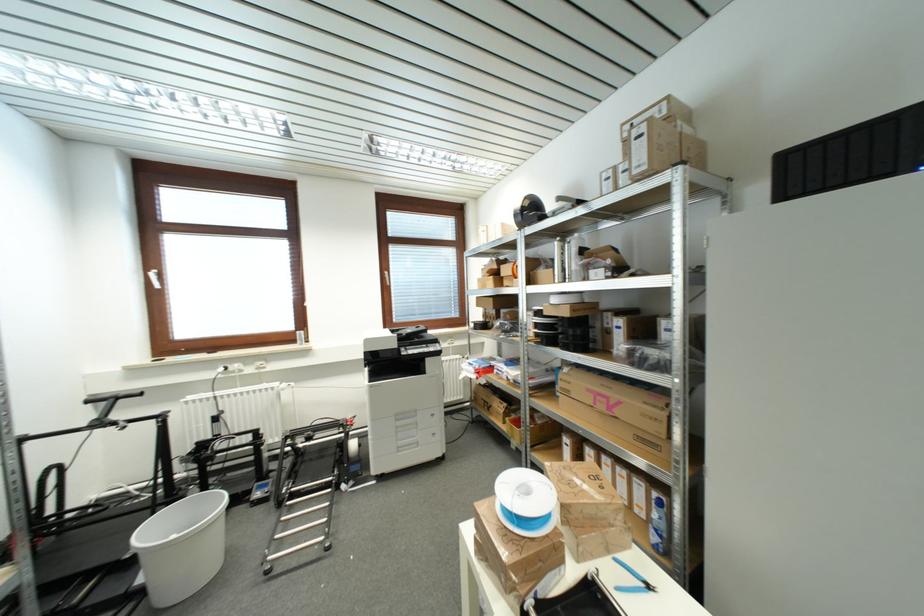
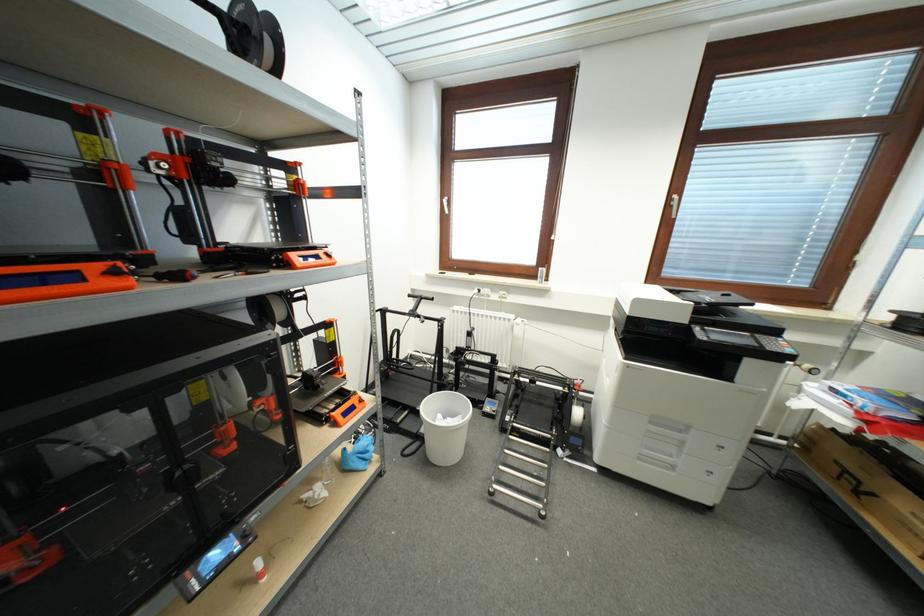
The point at (x=151, y=273) is marked in the first image. Where is the corresponding point in the second image?

(446, 200)